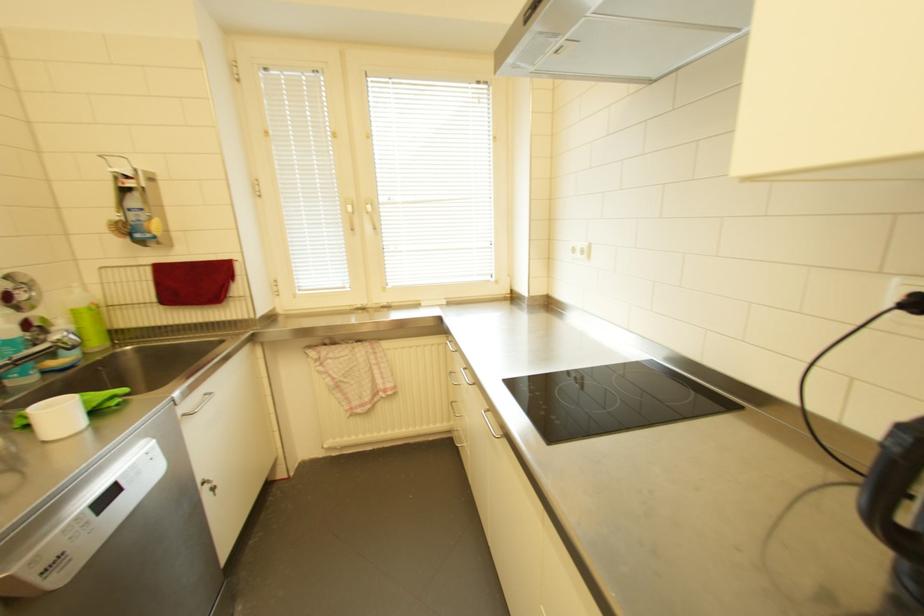
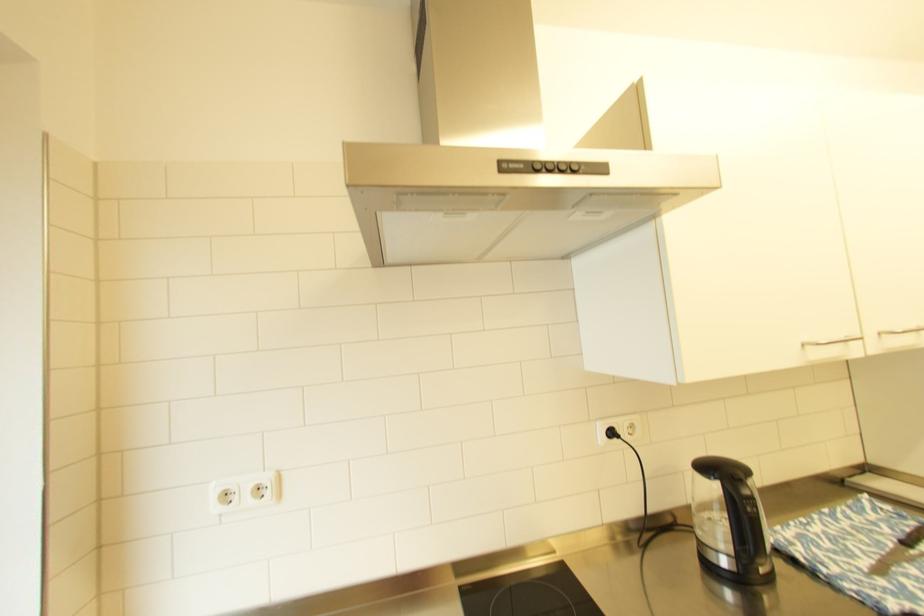
Question: The images are taken continuously from a first-person perspective. In which direction is your viewpoint rotating?

Choices:
 (A) Left
 (B) Right
 (C) Up
 (D) Down

Answer: (B)